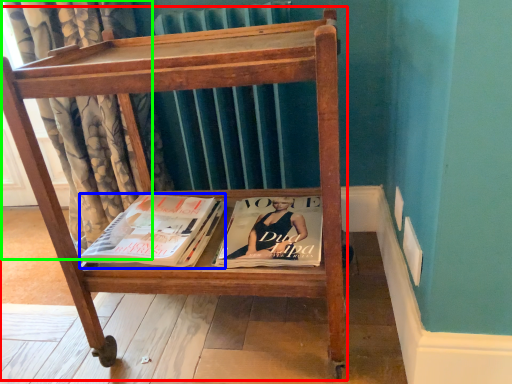
Question: Which object is the closest to the furniture (highlighted by a red box)? Choose among these: book (highlighted by a blue box) or curtain (highlighted by a green box).

Choices:
 (A) book
 (B) curtain

Answer: (A)